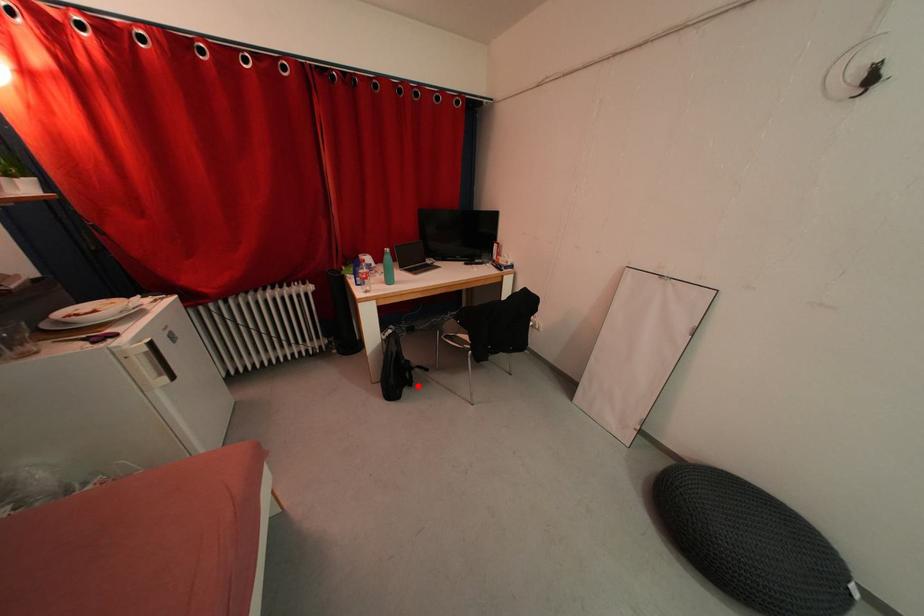
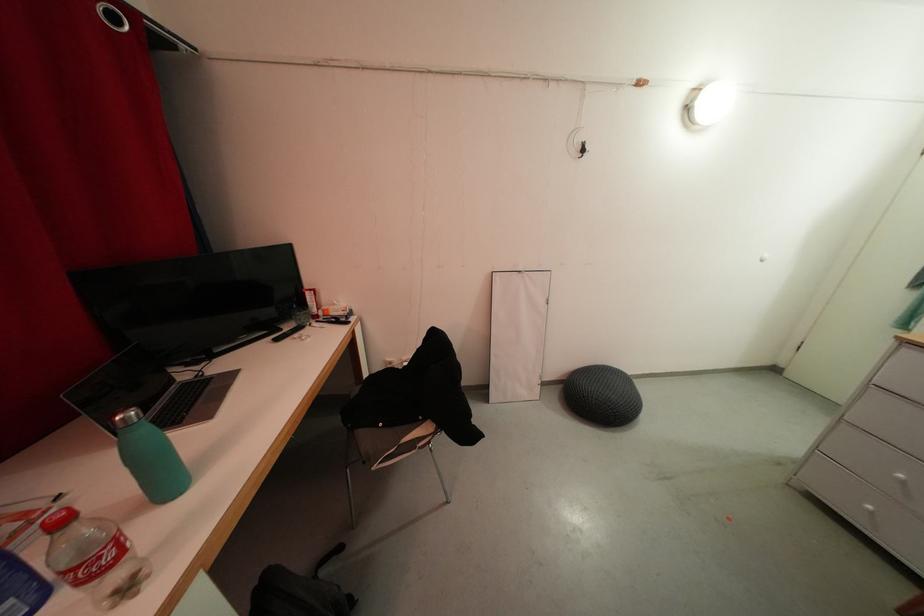
In the second image, find the point that corresponds to the highlighted location in the first image.

(357, 601)